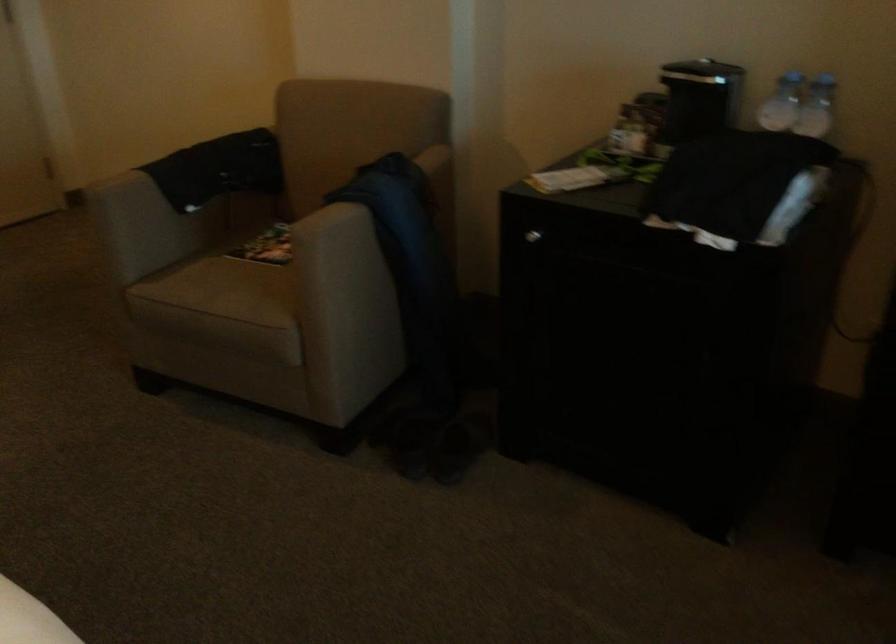
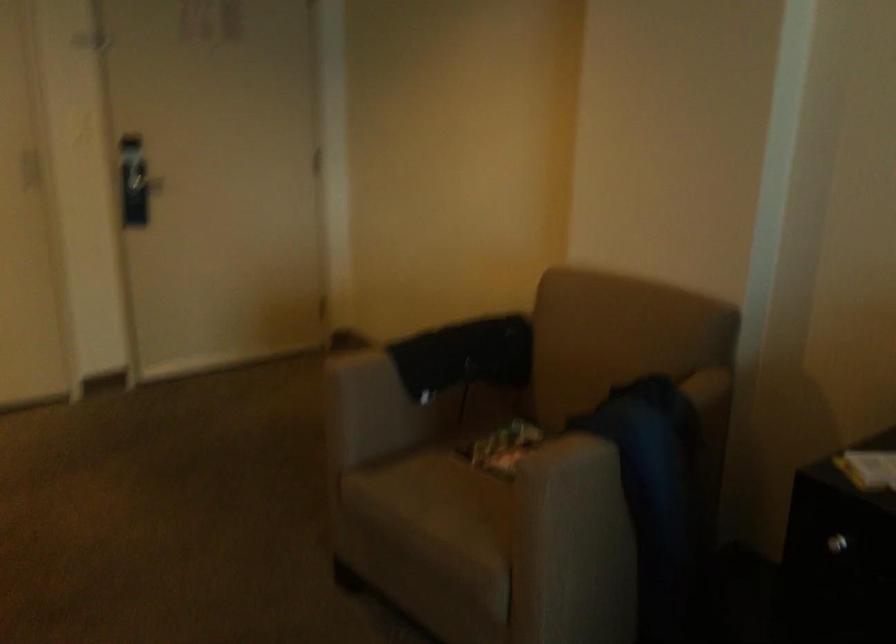
Where in the second image is the point corresponding to the point at 535,249 from the first image?

(833, 556)